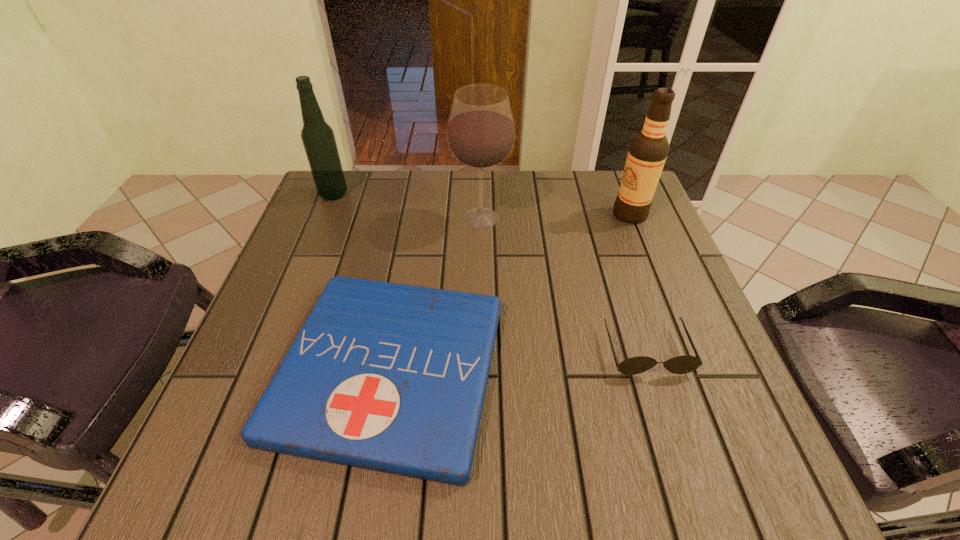
Identify the location of the second alcohol from right to left. (481, 135).

Where is `the rightmost alcohol`? This screenshot has width=960, height=540. the rightmost alcohol is located at coordinates (648, 150).

Find the location of a particular element. The image size is (960, 540). the leftmost alcohol is located at coordinates (318, 138).

Locate an element on the screen. The height and width of the screenshot is (540, 960). sunglasses is located at coordinates (681, 364).

At what (x,y) coordinates should I click in order to perform the action: click on the first-aid kit. Please return your answer as a coordinate pair (x, y). The width and height of the screenshot is (960, 540). Looking at the image, I should click on (389, 377).

You are a GUI agent. You are given a task and a screenshot of the screen. Output one action in this format:
    pyautogui.click(x=<x>, y=<y>)
    Task: Click on the free location located on the right of the second alcohol from left to right
    Image resolution: width=960 pixels, height=540 pixels.
    Given the screenshot: What is the action you would take?
    pyautogui.click(x=567, y=219)

The image size is (960, 540). Identify the location of vacant space located on the label of the rightmost alcohol. (561, 214).

In order to click on blank space located 0.250m on the label of the rightmost alcohol in this screenshot , I will do `click(513, 214)`.

This screenshot has height=540, width=960. Identify the location of vacant space situated 0.340m on the label of the rightmost alcohol. (477, 214).

Where is `vacant space situated 0.300m on the right of the leftmost alcohol`? The image size is (960, 540). vacant space situated 0.300m on the right of the leftmost alcohol is located at coordinates [x=461, y=194].